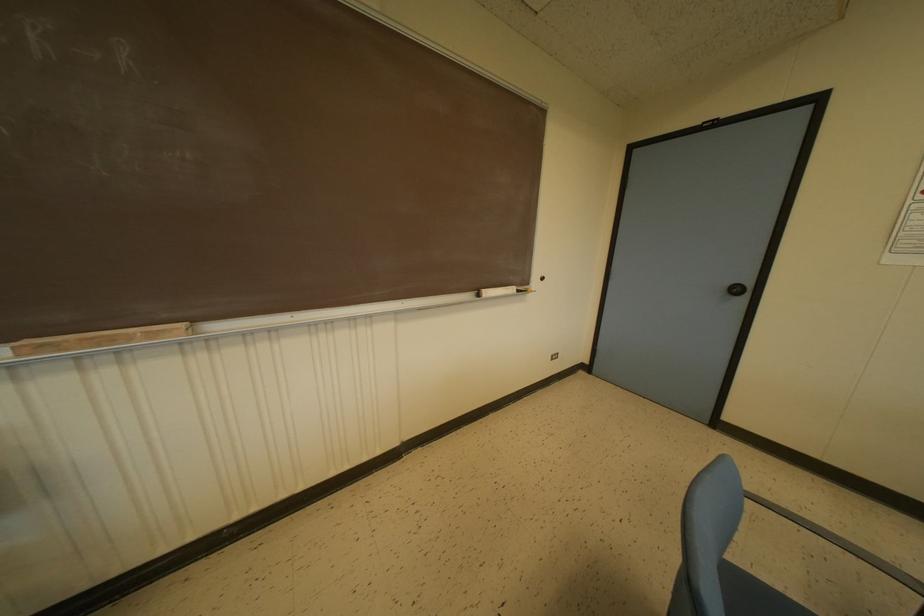
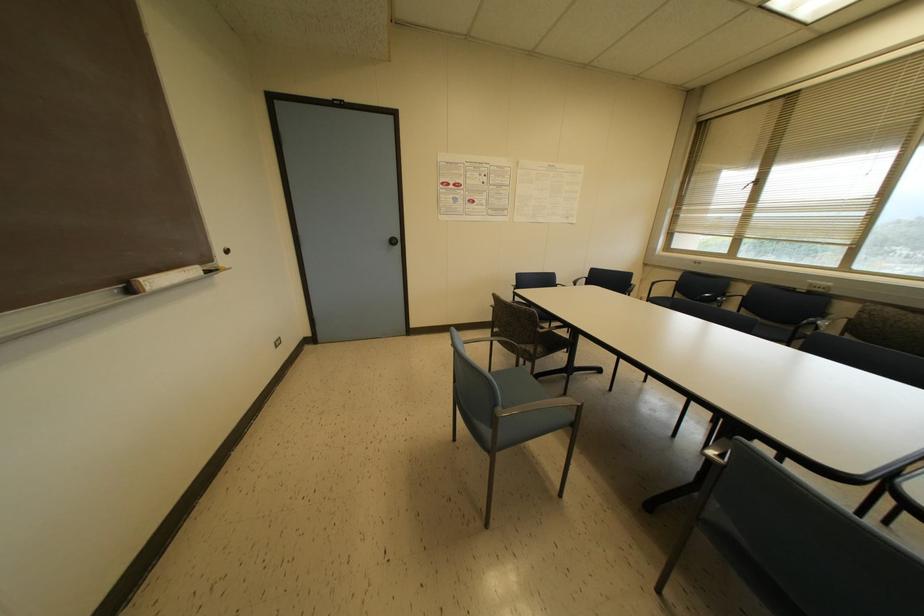
Based on the continuous images, in which direction is the camera rotating?

The camera's rotation is toward right-down.